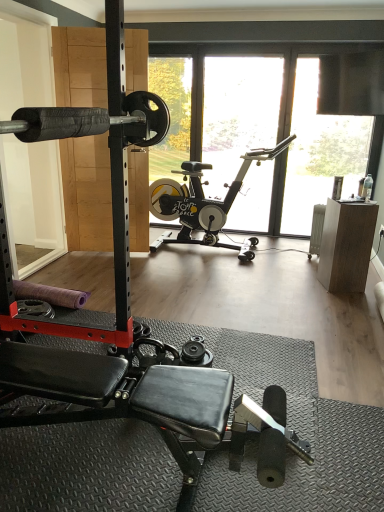
I want to click on free space in front of black rubber stationary bicycle at center, so click(x=257, y=306).